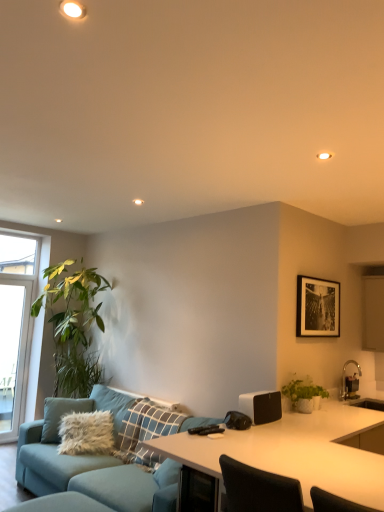
Describe the element at coordinates (10, 352) in the screenshot. I see `transparent glass window at left` at that location.

Identify the location of white matte speaker at right. This screenshot has width=384, height=512. (261, 406).

The width and height of the screenshot is (384, 512). What do you see at coordinates (61, 504) in the screenshot?
I see `light blue fabric swivel chair at lower left` at bounding box center [61, 504].

This screenshot has width=384, height=512. What do you see at coordinates (317, 307) in the screenshot?
I see `black matte picture frame at upper right` at bounding box center [317, 307].

Locate an element on the screen. This screenshot has height=512, width=384. green matte plant at right is located at coordinates (304, 394).

Considering the relative sizes of light blue fabric swivel chair at lower left and transparent glass window at left in the image provided, is light blue fabric swivel chair at lower left shorter than transparent glass window at left?

Correct, light blue fabric swivel chair at lower left is not as tall as transparent glass window at left.

From the image's perspective, relative to transparent glass window at left, is light blue fabric swivel chair at lower left above or below?

light blue fabric swivel chair at lower left is below transparent glass window at left.

Is point (77, 501) positioned behind point (6, 362)?

No, it is not.

Who is taller, light blue fabric swivel chair at lower left or white glossy desk at center?

Standing taller between the two is white glossy desk at center.

Where is `desk that is in front of the light blue fabric swivel chair at lower left`? desk that is in front of the light blue fabric swivel chair at lower left is located at coordinates (290, 455).

Is light blue fabric swivel chair at lower left positioned with its back to white glossy desk at center?

No, light blue fabric swivel chair at lower left is not facing the opposite direction of white glossy desk at center.

From a real-world perspective, which is physically below, teal fabric couch at center or white glossy desk at center?

In real-world perspective, teal fabric couch at center is lower.

What's the angular difference between teal fabric couch at center and white glossy desk at center's facing directions?

There is a 89.6-degree angle between the facing directions of teal fabric couch at center and white glossy desk at center.

Is teal fabric couch at center closer to camera compared to white glossy desk at center?

No, the depth of teal fabric couch at center is greater than that of white glossy desk at center.

Which of these two, teal fabric couch at center or white glossy desk at center, stands shorter?

With less height is teal fabric couch at center.

From the image's perspective, which object appears higher, transparent glass window at left or green matte plant at right?

green matte plant at right is shown above in the image.

Consider the image. Is transparent glass window at left at the left side of green matte plant at right?

Correct, you'll find transparent glass window at left to the left of green matte plant at right.

Between transparent glass window at left and green matte plant at right, which one has smaller size?

With smaller size is green matte plant at right.

Which is behind, point (30, 242) or point (301, 397)?

The point (30, 242) is behind.

Would you say black matte picture frame at upper right is to the left or to the right of green matte plant at right in the picture?

In the image, black matte picture frame at upper right appears on the right side of green matte plant at right.

Which point is more distant from viewer, (301, 297) or (302, 401)?

The point (301, 297) is more distant.

Between black matte picture frame at upper right and green matte plant at right, which one has smaller size?

green matte plant at right is smaller.

From the picture: Can you tell me how much black matte picture frame at upper right and green matte plant at right differ in facing direction?

The facing directions of black matte picture frame at upper right and green matte plant at right are 1.3 degrees apart.

You are a GUI agent. You are given a task and a screenshot of the screen. Output one action in this format:
    pyautogui.click(x=<x>, y=<y>)
    Task: Click on the window below the transparent glass window at left (from the image's perspective)
    This screenshot has height=512, width=384.
    Given the screenshot: What is the action you would take?
    pyautogui.click(x=23, y=313)

Does transparent glass window at left have a larger size compared to transparent glass window at left?

Incorrect, transparent glass window at left is not larger than transparent glass window at left.

Could transparent glass window at left be considered to be inside transparent glass window at left?

Yes, transparent glass window at left is inside transparent glass window at left.

Is transparent glass window at left turned away from transparent glass window at left?

Yes, transparent glass window at left is positioned with its back facing transparent glass window at left.

From a real-world perspective, is white matte speaker at right located higher than white glossy desk at center?

Yes, from a real-world perspective, white matte speaker at right is over white glossy desk at center

Considering the positions of points (273, 392) and (181, 463), is point (273, 392) closer to camera compared to point (181, 463)?

No, it is behind (181, 463).

From the image's perspective, is white matte speaker at right above or below white glossy desk at center?

Clearly, from the image's perspective, white matte speaker at right is above white glossy desk at center.

Is white matte speaker at right bigger or smaller than white glossy desk at center?

Considering their sizes, white matte speaker at right takes up less space than white glossy desk at center.

Locate an element on the screen. window screen that appears above the light blue fabric swivel chair at lower left (from a real-world perspective) is located at coordinates (10, 352).

I want to click on desk lying in front of the light blue fabric swivel chair at lower left, so click(290, 455).

Based on their spatial positions, is white matte speaker at right or white glossy desk at center closer to teal fabric couch at center?

white glossy desk at center.

Estimate the real-world distances between objects in this image. Which object is closer to transparent glass window at left, light blue fabric swivel chair at lower left or green matte plant at right?

light blue fabric swivel chair at lower left is closer to transparent glass window at left.

Based on their spatial positions, is white matte speaker at right or light blue fabric swivel chair at lower left closer to transparent glass window at left?

Based on the image, light blue fabric swivel chair at lower left appears to be nearer to transparent glass window at left.

When comparing their distances from transparent glass window at left, does light blue fabric swivel chair at lower left or green matte plant at right seem closer?

light blue fabric swivel chair at lower left is positioned closer to the anchor transparent glass window at left.

Estimate the real-world distances between objects in this image. Which object is closer to transparent glass window at left, white glossy desk at center or transparent glass window at left?

Based on the image, transparent glass window at left appears to be nearer to transparent glass window at left.

Which object lies further to the anchor point light blue fabric swivel chair at lower left, transparent glass window at left or transparent glass window at left?

The object further to light blue fabric swivel chair at lower left is transparent glass window at left.

Estimate the real-world distances between objects in this image. Which object is further from light blue fabric swivel chair at lower left, teal fabric couch at center or green matte plant at right?

green matte plant at right is further to light blue fabric swivel chair at lower left.

From the image, which object appears to be farther from black matte picture frame at upper right, white glossy desk at center or light blue fabric swivel chair at lower left?

light blue fabric swivel chair at lower left is positioned further to the anchor black matte picture frame at upper right.

Where is `studio couch located between light blue fabric swivel chair at lower left and transparent glass window at left in the depth direction`? Image resolution: width=384 pixels, height=512 pixels. studio couch located between light blue fabric swivel chair at lower left and transparent glass window at left in the depth direction is located at coordinates (93, 475).

Find the location of a particular element. Image resolution: width=384 pixels, height=512 pixels. houseplant located between light blue fabric swivel chair at lower left and white glossy desk at center in the left-right direction is located at coordinates (304, 394).

Where is `window located between transparent glass window at left and black matte picture frame at upper right in the left-right direction`? window located between transparent glass window at left and black matte picture frame at upper right in the left-right direction is located at coordinates (23, 313).

Locate an element on the screen. This screenshot has height=512, width=384. window situated between transparent glass window at left and green matte plant at right from left to right is located at coordinates (23, 313).